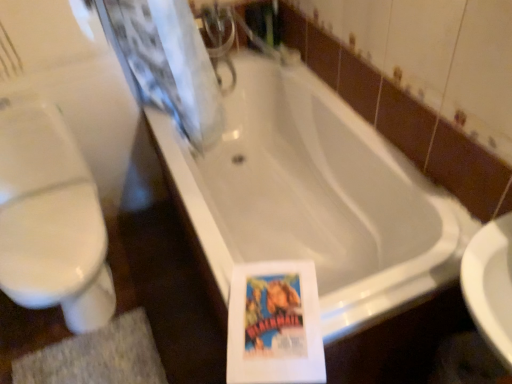
Question: Is white glossy toilet at left in contact with gray textured bath mat at lower left?

Choices:
 (A) no
 (B) yes

Answer: (A)

Question: Is white glossy toilet at left taller than gray textured bath mat at lower left?

Choices:
 (A) yes
 (B) no

Answer: (A)

Question: Does white glossy toilet at left appear on the left side of gray textured bath mat at lower left?

Choices:
 (A) yes
 (B) no

Answer: (A)

Question: Is white glossy toilet at left not close to gray textured bath mat at lower left?

Choices:
 (A) yes
 (B) no

Answer: (B)

Question: Is gray textured bath mat at lower left located within white glossy toilet at left?

Choices:
 (A) yes
 (B) no

Answer: (B)

Question: Is gray textured bath mat at lower left spatially inside white glossy toilet at left, or outside of it?

Choices:
 (A) outside
 (B) inside

Answer: (A)

Question: Considering the positions of gray textured bath mat at lower left and white glossy toilet at left in the image, is gray textured bath mat at lower left wider or thinner than white glossy toilet at left?

Choices:
 (A) thin
 (B) wide

Answer: (A)

Question: From the image's perspective, relative to white glossy toilet at left, is gray textured bath mat at lower left above or below?

Choices:
 (A) above
 (B) below

Answer: (B)

Question: Looking at the image, does gray textured bath mat at lower left seem bigger or smaller compared to white glossy toilet at left?

Choices:
 (A) small
 (B) big

Answer: (A)

Question: In terms of size, does white glossy toilet at left appear bigger or smaller than white glossy bathtub at center?

Choices:
 (A) big
 (B) small

Answer: (B)

Question: Is white glossy toilet at left inside or outside of white glossy bathtub at center?

Choices:
 (A) inside
 (B) outside

Answer: (B)

Question: In terms of height, does white glossy toilet at left look taller or shorter compared to white glossy bathtub at center?

Choices:
 (A) tall
 (B) short

Answer: (A)

Question: Does point (36, 258) appear closer or farther from the camera than point (367, 215)?

Choices:
 (A) farther
 (B) closer

Answer: (B)

Question: Would you say white glossy bathtub at center is to the left or to the right of white glossy toilet at left in the picture?

Choices:
 (A) right
 (B) left

Answer: (A)

Question: In terms of height, does white glossy bathtub at center look taller or shorter compared to white glossy toilet at left?

Choices:
 (A) short
 (B) tall

Answer: (A)